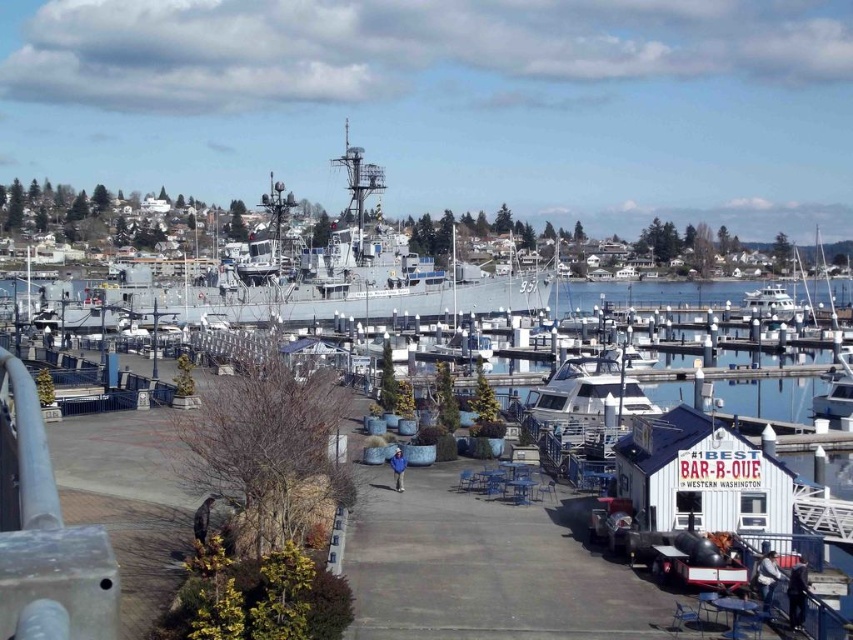
You are standing at the point marked as point (x=577, y=403) and want to take a photo of the point marked as point (x=776, y=292). Considering the marina scene described, will the white building with the blue roof be in the background of your photo?

Yes, the white building with the blue roof will be in the background of your photo because point (x=577, y=403) is closer to the camera than point (x=776, y=292), meaning the latter is further away and behind the building.

You are a photographer planning to take a photo of the gray metallic ship at center and the white glossy boat at center. Which one should you focus on first if you want to capture both in the frame without moving the camera?

The gray metallic ship at center should be focused on first because it is larger in size compared to the white glossy boat at center, making it more prominent in the frame.